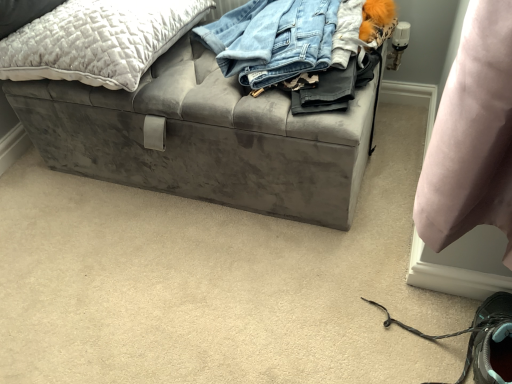
At what (x,y) coordinates should I click in order to perform the action: click on vacant space behind gray suede shoe at lower right. Please return your answer as a coordinate pair (x, y). Looking at the image, I should click on (359, 250).